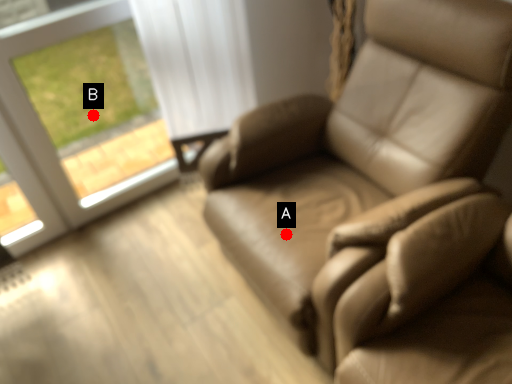
Question: Two points are circled on the image, labeled by A and B beside each circle. Which point is closer to the camera taking this photo?

Choices:
 (A) A is closer
 (B) B is closer

Answer: (A)